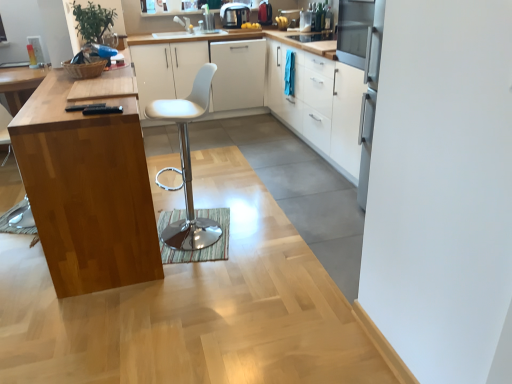
Question: Is wooden cutting board at left wider or thinner than metallic silver toaster at upper center, the 1th appliance in the right-to-left sequence?

Choices:
 (A) thin
 (B) wide

Answer: (B)

Question: Is wooden cutting board at left situated inside metallic silver toaster at upper center, positioned as the 2th appliance in left-to-right order, or outside?

Choices:
 (A) inside
 (B) outside

Answer: (B)

Question: Which object is positioned farthest from the metallic silver toaster at upper center, the 1th appliance in the right-to-left sequence?

Choices:
 (A) white glossy cabinets at upper center, which is counted as the 1th cabinetry, starting from the right
 (B) white matte cabinet at center, which ranks as the third cabinetry in right-to-left order
 (C) white leather swivel chair at center
 (D) wooden cutting board at left
 (E) white matte cabinet at center, marked as the 1th cabinetry in a left-to-right arrangement

Answer: (D)

Question: Estimate the real-world distances between objects in this image. Which object is closer to the white matte cabinet at center, the 4th cabinetry viewed from the right?

Choices:
 (A) metallic silver toaster at upper center, positioned as the 2th appliance in left-to-right order
 (B) wooden cutting board at left
 (C) white leather swivel chair at center
 (D) white matte cabinet at center, which ranks as the third cabinetry in right-to-left order
 (E) metallic silver toaster at upper center, which ranks as the 2th appliance in right-to-left order

Answer: (D)